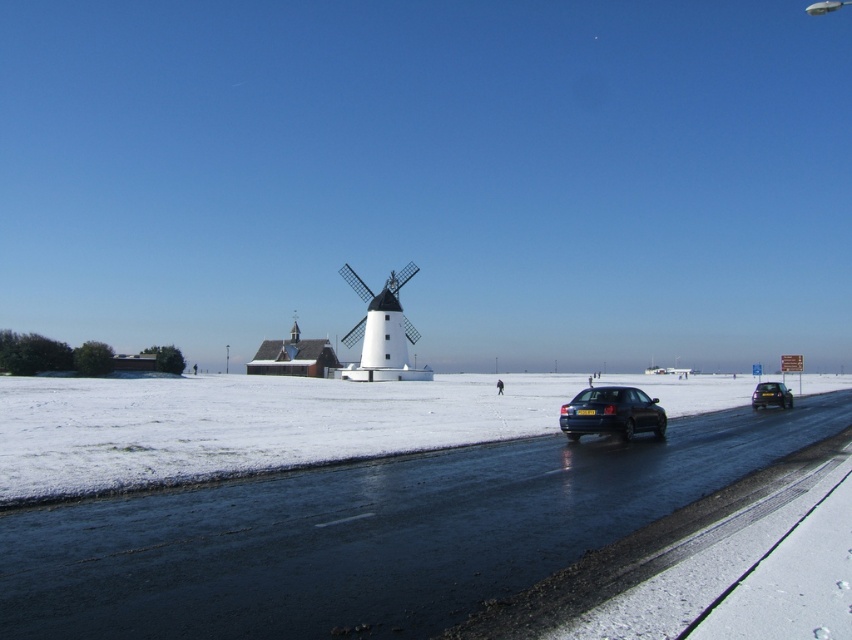
Measure the distance between glossy dark blue car at center and shiny black sedan at right.

glossy dark blue car at center and shiny black sedan at right are 93.05 feet apart from each other.

Does glossy dark blue car at center have a lesser width compared to shiny black sedan at right?

Yes.

In the scene shown: Who is more distant from viewer, (655, 438) or (758, 385)?

The point (758, 385) is behind.

Where is `glossy dark blue car at center`? The image size is (852, 640). glossy dark blue car at center is located at coordinates (612, 413).

Is point (358, 291) farther from camera compared to point (608, 413)?

Yes, it is.

Can you confirm if white matte windmill at center is positioned below glossy dark blue car at center?

Actually, white matte windmill at center is above glossy dark blue car at center.

Between point (372, 316) and point (588, 412), which one is positioned in front?

Positioned in front is point (588, 412).

I want to click on white matte windmill at center, so click(x=381, y=332).

Who is lower down, white powdery snow at road center or glossy dark blue car at center?

white powdery snow at road center is lower down.

Does white powdery snow at road center appear over glossy dark blue car at center?

No.

Find the location of `white powdery snow at road center`. white powdery snow at road center is located at coordinates (245, 424).